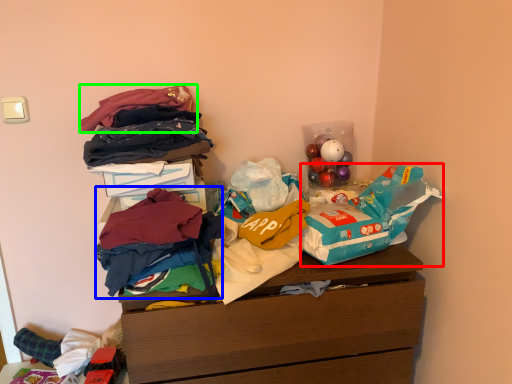
Question: Considering the real-world distances, which object is farthest from grocery bag (highlighted by a red box)? clothing (highlighted by a blue box) or clothing (highlighted by a green box)?

Choices:
 (A) clothing
 (B) clothing

Answer: (B)